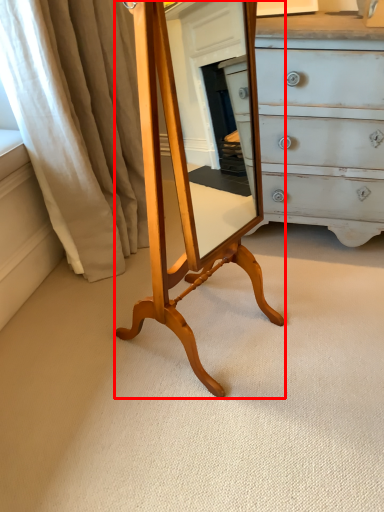
Question: Considering the relative positions of table (annotated by the red box) and curtain in the image provided, where is table (annotated by the red box) located with respect to the staircase?

Choices:
 (A) left
 (B) right

Answer: (B)